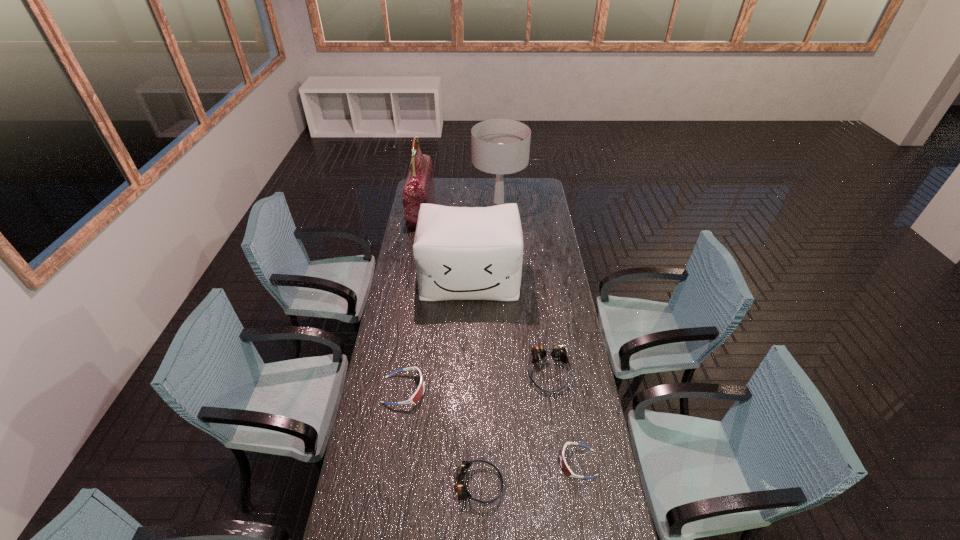
This screenshot has width=960, height=540. In the image, there is a desktop. In order to click on free space at the right edge in this screenshot , I will do `click(547, 340)`.

Identify the location of free point between the third farthest object and the right bronze goggles. (509, 325).

Find the location of a particular element. The image size is (960, 540). free space between the farther red goggles and the smaller bronze goggles is located at coordinates (442, 437).

The height and width of the screenshot is (540, 960). What are the coordinates of `vacant region between the bigger red goggles and the farther bronze goggles` in the screenshot? It's located at (476, 381).

Find the location of a particular element. free spot between the bigger red goggles and the farther bronze goggles is located at coordinates (476, 381).

Locate an element on the screen. object that is the third closest to the handbag is located at coordinates (417, 395).

Where is `object that is the closest to the cushion`? The width and height of the screenshot is (960, 540). object that is the closest to the cushion is located at coordinates (419, 188).

Find the location of a particular element. The width and height of the screenshot is (960, 540). the second closest goggles to the left bronze goggles is located at coordinates (417, 395).

This screenshot has width=960, height=540. In order to click on the third closest goggles to the farther bronze goggles in this screenshot , I will do `click(417, 395)`.

Locate which bronze goggles is the second closest to the brown lampshade. Please provide its 2D coordinates. Your answer should be formatted as a tuple, i.e. [(x, y)], where the tuple contains the x and y coordinates of a point satisfying the conditions above.

[(463, 466)]